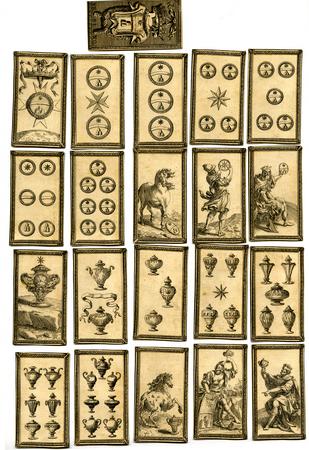
Where is `jar`? jar is located at coordinates (172, 286), (157, 264).